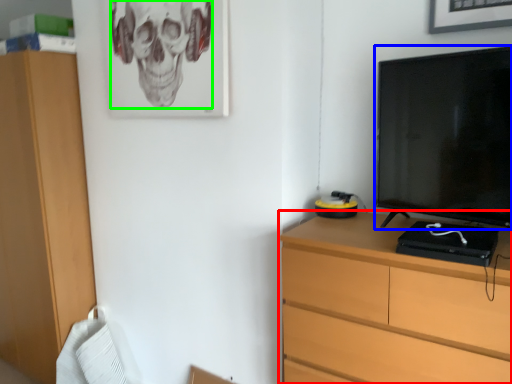
Question: Estimate the real-world distances between objects in this image. Which object is farther from chest of drawers (highlighted by a red box), television (highlighted by a blue box) or skull (highlighted by a green box)?

Choices:
 (A) television
 (B) skull

Answer: (B)